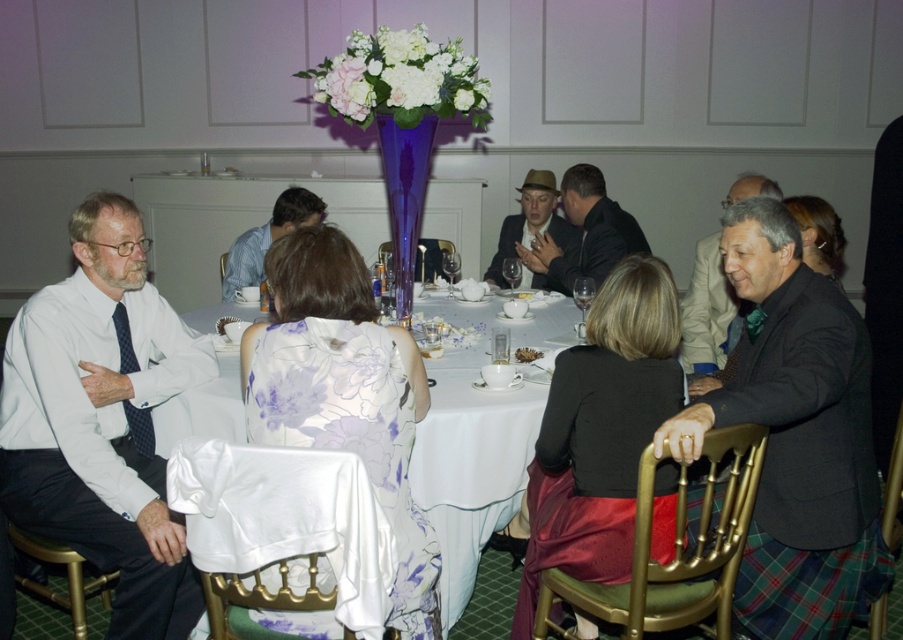
Is matte black jacket at center positioned at the back of dark gray suit at right?

Yes, matte black jacket at center is behind dark gray suit at right.

How far apart are matte black jacket at center and dark gray suit at right?

matte black jacket at center and dark gray suit at right are 65.29 centimeters apart from each other.

Which is in front, point (582, 177) or point (729, 301)?

Positioned in front is point (729, 301).

Where is `matte black jacket at center`? The height and width of the screenshot is (640, 903). matte black jacket at center is located at coordinates (584, 234).

Looking at this image, can you confirm if matte black jacket at center is positioned to the left of blue striped shirt at center?

In fact, matte black jacket at center is to the right of blue striped shirt at center.

Between point (591, 168) and point (295, 221), which one is positioned behind?

Point (591, 168)

At what (x,y) coordinates should I click in order to perform the action: click on matte black jacket at center. Please return your answer as a coordinate pair (x, y). The image size is (903, 640). Looking at the image, I should click on click(584, 234).

Between white shirt at left and dark gray suit at right, which one is positioned higher?

dark gray suit at right is higher up.

Is point (191, 573) behind point (701, 332)?

That is False.

In order to click on white shirt at left in this screenshot , I will do `click(101, 419)`.